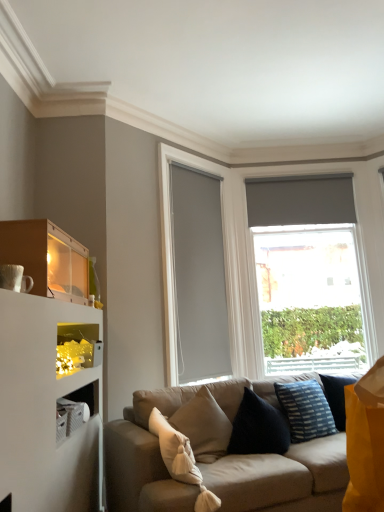
Question: From a real-world perspective, is beige fabric couch at center physically above matte gray glass door at center?

Choices:
 (A) yes
 (B) no

Answer: (B)

Question: Is beige fabric couch at center turned away from matte gray glass door at center?

Choices:
 (A) yes
 (B) no

Answer: (B)

Question: Is beige fabric couch at center thinner than matte gray glass door at center?

Choices:
 (A) no
 (B) yes

Answer: (A)

Question: From the image's perspective, is beige fabric couch at center on matte gray glass door at center?

Choices:
 (A) no
 (B) yes

Answer: (A)

Question: From the image's perspective, is beige fabric couch at center below matte gray glass door at center?

Choices:
 (A) yes
 (B) no

Answer: (A)

Question: Is beige fabric couch at center completely or partially outside of matte gray glass door at center?

Choices:
 (A) no
 (B) yes

Answer: (B)

Question: Does matte gray roller blind at right touch blue striped fabric pillow at lower right, which is the first pillow from back to front?

Choices:
 (A) no
 (B) yes

Answer: (A)

Question: Considering the relative sizes of matte gray roller blind at right and blue striped fabric pillow at lower right, the 2th pillow in the left-to-right sequence, in the image provided, is matte gray roller blind at right taller than blue striped fabric pillow at lower right, the 2th pillow in the left-to-right sequence,?

Choices:
 (A) yes
 (B) no

Answer: (A)

Question: Is matte gray roller blind at right at the right side of blue striped fabric pillow at lower right, which is the first pillow from back to front?

Choices:
 (A) no
 (B) yes

Answer: (B)

Question: Is matte gray roller blind at right oriented away from blue striped fabric pillow at lower right, which is the first pillow from back to front?

Choices:
 (A) no
 (B) yes

Answer: (A)

Question: From a real-world perspective, is matte gray roller blind at right located beneath blue striped fabric pillow at lower right, which is the first pillow from back to front?

Choices:
 (A) no
 (B) yes

Answer: (A)

Question: Is matte gray roller blind at right surrounding blue striped fabric pillow at lower right, arranged as the 1th pillow when viewed from the right?

Choices:
 (A) no
 (B) yes

Answer: (A)

Question: Is matte wood shelf at upper left touching beige fabric couch at center?

Choices:
 (A) yes
 (B) no

Answer: (B)